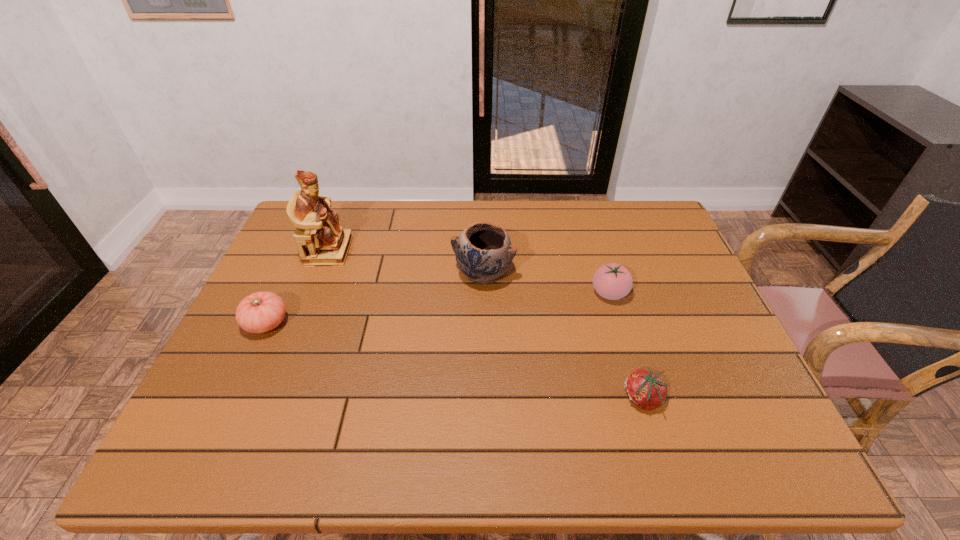
The width and height of the screenshot is (960, 540). What are the coordinates of `free spot between the figurine and the pottery` in the screenshot? It's located at (406, 262).

Identify the location of blank region between the pottery and the tallest object. This screenshot has width=960, height=540. (406, 262).

Image resolution: width=960 pixels, height=540 pixels. In order to click on vacant region between the pottery and the shortest tomato in this screenshot , I will do `click(564, 336)`.

Identify the location of unoccupied position between the figurine and the shortest object. [486, 325].

Identify the location of vacant region between the figurine and the nearest object. click(486, 325).

This screenshot has width=960, height=540. Find the location of `vacant area that lies between the shortest object and the leftmost tomato`. vacant area that lies between the shortest object and the leftmost tomato is located at coordinates (455, 361).

Identify which object is the second closest to the leftmost tomato. Please provide its 2D coordinates. Your answer should be formatted as a tuple, i.e. [(x, y)], where the tuple contains the x and y coordinates of a point satisfying the conditions above.

[(483, 251)]

Locate which object ranks third in proximity to the leftmost tomato. Please provide its 2D coordinates. Your answer should be formatted as a tuple, i.e. [(x, y)], where the tuple contains the x and y coordinates of a point satisfying the conditions above.

[(612, 281)]

Identify which tomato is the second closest to the figurine. Please provide its 2D coordinates. Your answer should be formatted as a tuple, i.e. [(x, y)], where the tuple contains the x and y coordinates of a point satisfying the conditions above.

[(612, 281)]

Image resolution: width=960 pixels, height=540 pixels. What are the coordinates of `tomato that is the closest to the shortest tomato` in the screenshot? It's located at (612, 281).